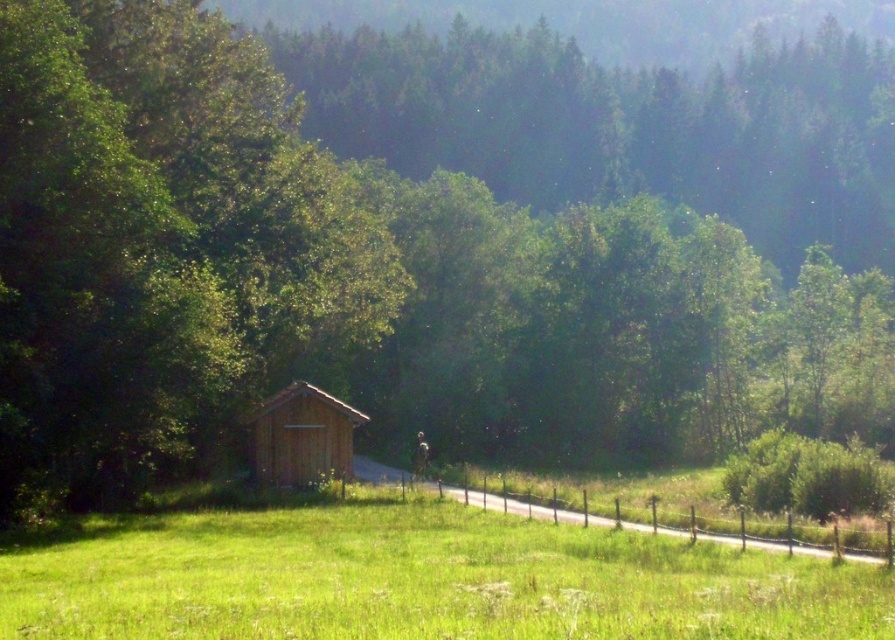
Between point (24, 611) and point (346, 404), which one is positioned behind?

Positioned behind is point (346, 404).

Does green grassy field at center come behind wooden cabin at center?

No.

Which is in front, point (126, 524) or point (252, 460)?

Point (126, 524) is more forward.

You are a GUI agent. You are given a task and a screenshot of the screen. Output one action in this format:
    pyautogui.click(x=<x>, y=<y>)
    Task: Click on the green grassy field at center
    The height and width of the screenshot is (640, 895).
    Given the screenshot: What is the action you would take?
    pyautogui.click(x=420, y=580)